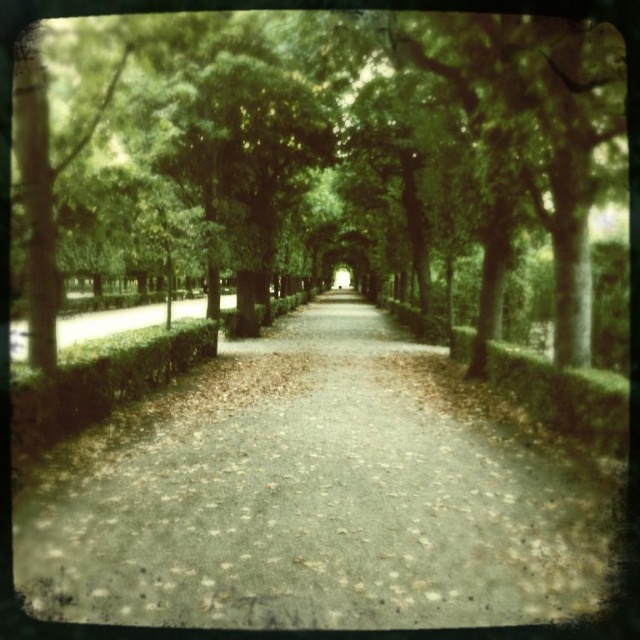
Question: Can you confirm if green leafy tree at center is positioned to the left of dull gray concrete path at center?

Choices:
 (A) yes
 (B) no

Answer: (A)

Question: Is green leafy tree at center thinner than dull gray concrete path at center?

Choices:
 (A) no
 (B) yes

Answer: (A)

Question: Which of the following is the closest to the observer?

Choices:
 (A) green leafy tree at center
 (B) dull gray concrete path at center

Answer: (B)

Question: Can you confirm if green leafy tree at center is positioned to the left of dull gray concrete path at center?

Choices:
 (A) no
 (B) yes

Answer: (B)

Question: Which object is closer to the camera taking this photo?

Choices:
 (A) dull gray concrete path at center
 (B) green leafy tree at center

Answer: (A)

Question: Which of the following is the closest to the observer?

Choices:
 (A) dull gray concrete path at center
 (B) green leafy tree at center

Answer: (A)